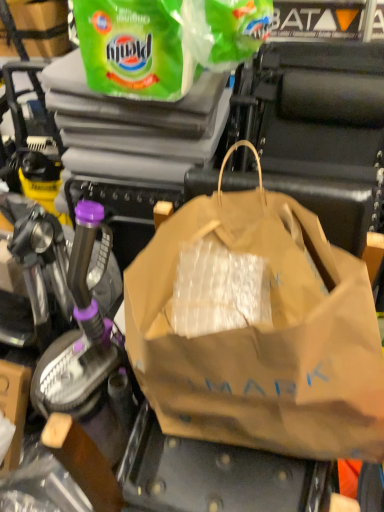
What are the coordinates of `green plastic bag at upper center, which ranks as the 2th plastic bag in bottom-to-top order` in the screenshot? It's located at (165, 42).

The image size is (384, 512). Describe the element at coordinates (165, 42) in the screenshot. I see `green plastic bag at upper center, arranged as the 1th plastic bag when viewed from the top` at that location.

Based on the photo, how much space does green plastic bag at upper center, which ranks as the 2th plastic bag in bottom-to-top order, occupy horizontally?

14.30 inches.

In the scene shown: Measure the distance between point (x=232, y=56) and camera.

Point (x=232, y=56) is 37.68 inches away from camera.

What do you see at coordinates (263, 338) in the screenshot? The image size is (384, 512). I see `brown paper bag at center, which is the first plastic bag from bottom to top` at bounding box center [263, 338].

In the scene shown: In order to face brown paper bag at center, arranged as the 2th plastic bag when viewed from the top, should I rotate leftwards or rightwards?

Rotate right and turn 10.499 degrees.

Image resolution: width=384 pixels, height=512 pixels. Find the location of `brown paper bag at center, which is the first plastic bag from bottom to top`. brown paper bag at center, which is the first plastic bag from bottom to top is located at coordinates (263, 338).

This screenshot has width=384, height=512. I want to click on green plastic bag at upper center, which ranks as the 2th plastic bag in bottom-to-top order, so click(165, 42).

Is brown paper bag at center, arranged as the 2th plastic bag when viewed from the top, at the right side of green plastic bag at upper center, which ranks as the 2th plastic bag in bottom-to-top order?

Yes.

Which object is further away from the camera taking this photo, brown paper bag at center, which is the first plastic bag from bottom to top, or green plastic bag at upper center, arranged as the 1th plastic bag when viewed from the top?

green plastic bag at upper center, arranged as the 1th plastic bag when viewed from the top.

Which is closer, (259, 190) or (148, 66)?

Point (259, 190) is positioned closer to the camera compared to point (148, 66).

From the image's perspective, is brown paper bag at center, which is the first plastic bag from bottom to top, located above green plastic bag at upper center, which ranks as the 2th plastic bag in bottom-to-top order?

Incorrect, from the image's perspective, brown paper bag at center, which is the first plastic bag from bottom to top, is lower than green plastic bag at upper center, which ranks as the 2th plastic bag in bottom-to-top order.

From a real-world perspective, is brown paper bag at center, which is the first plastic bag from bottom to top, positioned over green plastic bag at upper center, which ranks as the 2th plastic bag in bottom-to-top order, based on gravity?

No, from a real-world perspective, brown paper bag at center, which is the first plastic bag from bottom to top, is not above green plastic bag at upper center, which ranks as the 2th plastic bag in bottom-to-top order.

Which object is thinner, brown paper bag at center, which is the first plastic bag from bottom to top, or green plastic bag at upper center, which ranks as the 2th plastic bag in bottom-to-top order?

With smaller width is green plastic bag at upper center, which ranks as the 2th plastic bag in bottom-to-top order.

From their relative heights in the image, would you say brown paper bag at center, arranged as the 2th plastic bag when viewed from the top, is taller or shorter than green plastic bag at upper center, arranged as the 1th plastic bag when viewed from the top?

In the image, brown paper bag at center, arranged as the 2th plastic bag when viewed from the top, appears to be taller than green plastic bag at upper center, arranged as the 1th plastic bag when viewed from the top.

Who is smaller, brown paper bag at center, which is the first plastic bag from bottom to top, or green plastic bag at upper center, arranged as the 1th plastic bag when viewed from the top?

With smaller size is green plastic bag at upper center, arranged as the 1th plastic bag when viewed from the top.

Which is correct: brown paper bag at center, arranged as the 2th plastic bag when viewed from the top, is inside green plastic bag at upper center, which ranks as the 2th plastic bag in bottom-to-top order, or outside of it?

brown paper bag at center, arranged as the 2th plastic bag when viewed from the top, is spatially situated outside green plastic bag at upper center, which ranks as the 2th plastic bag in bottom-to-top order.

Is there a large distance between brown paper bag at center, arranged as the 2th plastic bag when viewed from the top, and green plastic bag at upper center, arranged as the 1th plastic bag when viewed from the top?

No, brown paper bag at center, arranged as the 2th plastic bag when viewed from the top, is not far from green plastic bag at upper center, arranged as the 1th plastic bag when viewed from the top.

Could you tell me if brown paper bag at center, arranged as the 2th plastic bag when viewed from the top, is facing green plastic bag at upper center, which ranks as the 2th plastic bag in bottom-to-top order?

No, brown paper bag at center, arranged as the 2th plastic bag when viewed from the top, is not facing towards green plastic bag at upper center, which ranks as the 2th plastic bag in bottom-to-top order.

The height and width of the screenshot is (512, 384). Find the location of `plastic bag lying above the brown paper bag at center, which is the first plastic bag from bottom to top (from the image's perspective)`. plastic bag lying above the brown paper bag at center, which is the first plastic bag from bottom to top (from the image's perspective) is located at coordinates (165, 42).

Considering the positions of objects green plastic bag at upper center, which ranks as the 2th plastic bag in bottom-to-top order, and brown paper bag at center, arranged as the 2th plastic bag when viewed from the top, in the image provided, who is more to the left, green plastic bag at upper center, which ranks as the 2th plastic bag in bottom-to-top order, or brown paper bag at center, arranged as the 2th plastic bag when viewed from the top,?

From the viewer's perspective, green plastic bag at upper center, which ranks as the 2th plastic bag in bottom-to-top order, appears more on the left side.

Between green plastic bag at upper center, which ranks as the 2th plastic bag in bottom-to-top order, and brown paper bag at center, arranged as the 2th plastic bag when viewed from the top, which one is positioned behind?

green plastic bag at upper center, which ranks as the 2th plastic bag in bottom-to-top order, is further from the camera.

Which point is more forward, (178,44) or (275,411)?

The point (275,411) is in front.

Looking at this image, from the image's perspective, does green plastic bag at upper center, arranged as the 1th plastic bag when viewed from the top, appear lower than brown paper bag at center, arranged as the 2th plastic bag when viewed from the top?

No, from the image's perspective, green plastic bag at upper center, arranged as the 1th plastic bag when viewed from the top, is not below brown paper bag at center, arranged as the 2th plastic bag when viewed from the top.

From a real-world perspective, which is physically below, green plastic bag at upper center, arranged as the 1th plastic bag when viewed from the top, or brown paper bag at center, which is the first plastic bag from bottom to top?

brown paper bag at center, which is the first plastic bag from bottom to top.

Which of these two, green plastic bag at upper center, which ranks as the 2th plastic bag in bottom-to-top order, or brown paper bag at center, which is the first plastic bag from bottom to top, is wider?

Wider between the two is brown paper bag at center, which is the first plastic bag from bottom to top.

From their relative heights in the image, would you say green plastic bag at upper center, which ranks as the 2th plastic bag in bottom-to-top order, is taller or shorter than brown paper bag at center, which is the first plastic bag from bottom to top?

Clearly, green plastic bag at upper center, which ranks as the 2th plastic bag in bottom-to-top order, is shorter compared to brown paper bag at center, which is the first plastic bag from bottom to top.

Is green plastic bag at upper center, which ranks as the 2th plastic bag in bottom-to-top order, smaller than brown paper bag at center, which is the first plastic bag from bottom to top?

Yes, green plastic bag at upper center, which ranks as the 2th plastic bag in bottom-to-top order, is smaller than brown paper bag at center, which is the first plastic bag from bottom to top.

Is green plastic bag at upper center, which ranks as the 2th plastic bag in bottom-to-top order, not inside brown paper bag at center, which is the first plastic bag from bottom to top?

green plastic bag at upper center, which ranks as the 2th plastic bag in bottom-to-top order, is positioned outside brown paper bag at center, which is the first plastic bag from bottom to top.

Is there a large distance between green plastic bag at upper center, which ranks as the 2th plastic bag in bottom-to-top order, and brown paper bag at center, arranged as the 2th plastic bag when viewed from the top?

Actually, green plastic bag at upper center, which ranks as the 2th plastic bag in bottom-to-top order, and brown paper bag at center, arranged as the 2th plastic bag when viewed from the top, are a little close together.

Is green plastic bag at upper center, arranged as the 1th plastic bag when viewed from the top, aimed at brown paper bag at center, which is the first plastic bag from bottom to top?

No, green plastic bag at upper center, arranged as the 1th plastic bag when viewed from the top, does not turn towards brown paper bag at center, which is the first plastic bag from bottom to top.

This screenshot has width=384, height=512. Identify the location of plastic bag that appears on the left of brown paper bag at center, which is the first plastic bag from bottom to top. (165, 42).

Image resolution: width=384 pixels, height=512 pixels. There is a brown paper bag at center, which is the first plastic bag from bottom to top. Find the location of `plastic bag above it (from a real-world perspective)`. plastic bag above it (from a real-world perspective) is located at coordinates (165, 42).

In order to click on plastic bag behind the brown paper bag at center, which is the first plastic bag from bottom to top in this screenshot , I will do `click(165, 42)`.